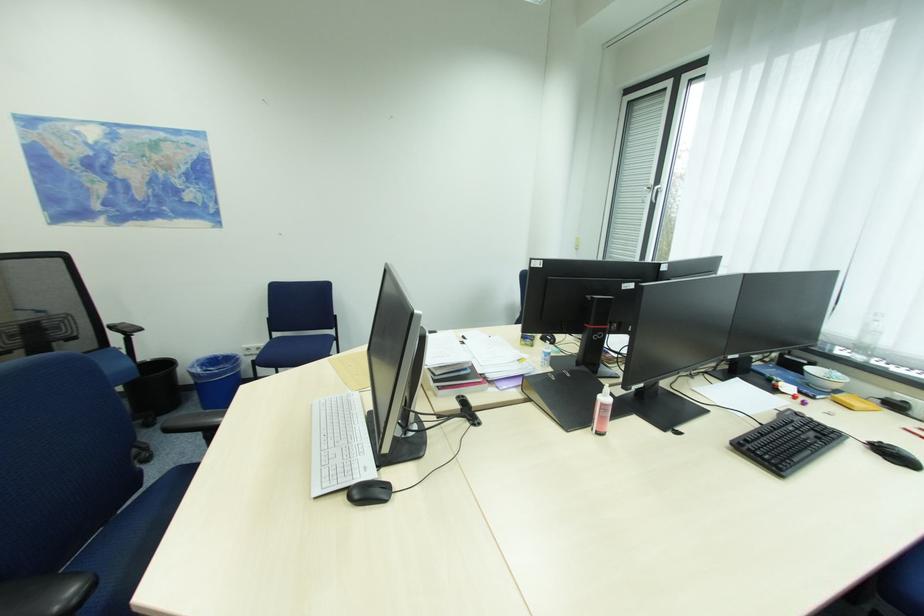
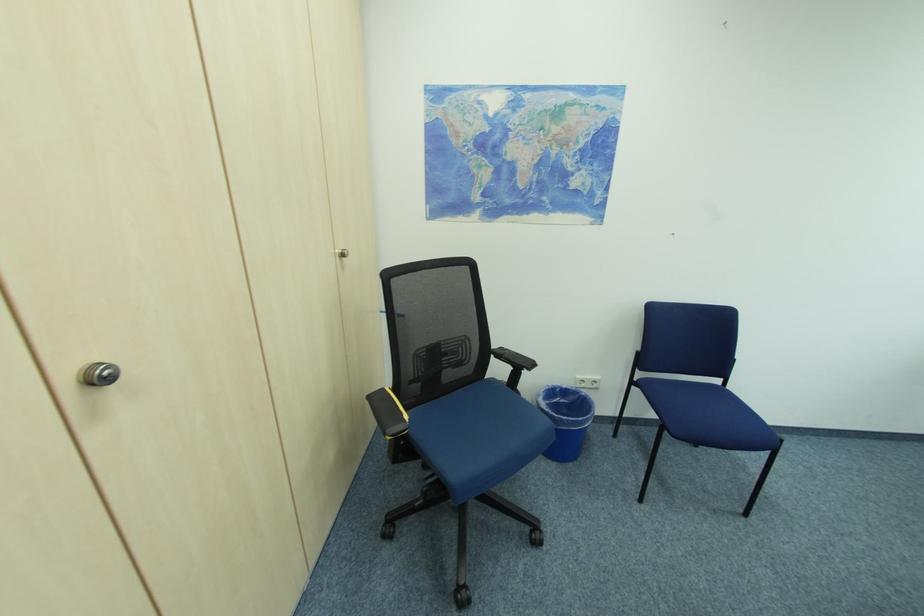
Question: Which direction would the cameraman need to move to produce the second image? Reply with the corresponding letter.

Choices:
 (A) Left
 (B) Right
 (C) Forward
 (D) Backward

Answer: (A)